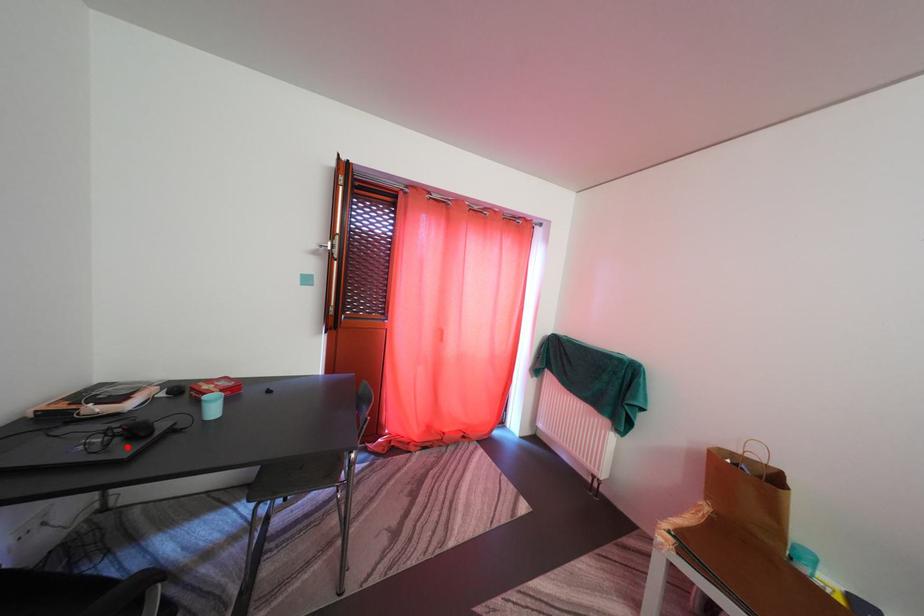
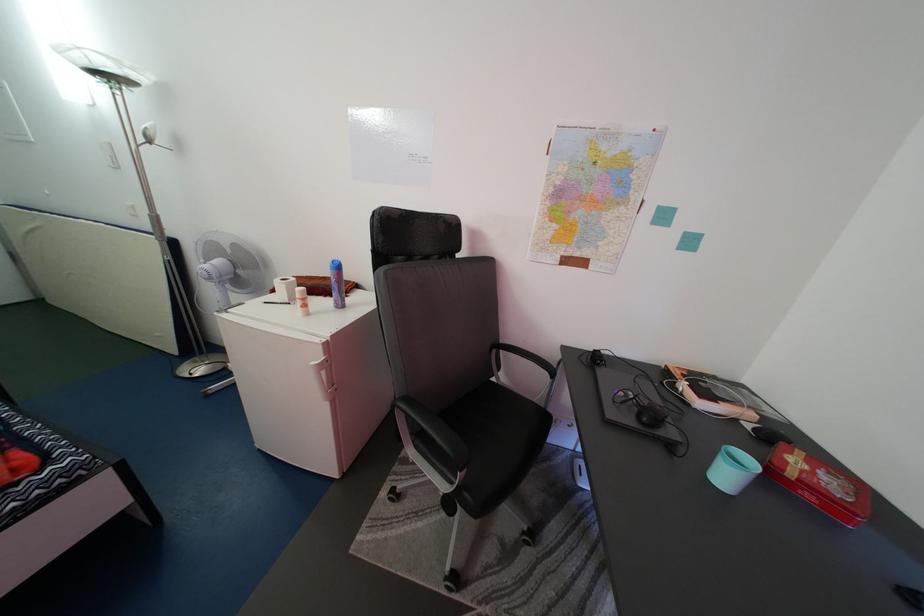
Where in the second image is the point corresponding to the highlighted location from the first image?

(646, 416)